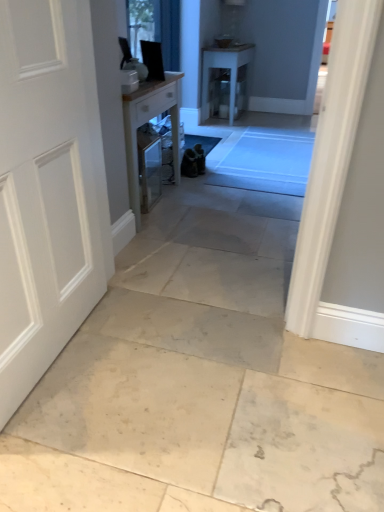
Question: From the image's perspective, does clear glass window at upper center appear lower than white matte door at left?

Choices:
 (A) yes
 (B) no

Answer: (B)

Question: Can you confirm if clear glass window at upper center is positioned to the right of white matte door at left?

Choices:
 (A) no
 (B) yes

Answer: (B)

Question: Is clear glass window at upper center in front of white matte door at left?

Choices:
 (A) yes
 (B) no

Answer: (B)

Question: Is clear glass window at upper center thinner than white matte door at left?

Choices:
 (A) yes
 (B) no

Answer: (A)

Question: From a real-world perspective, is clear glass window at upper center on white matte door at left?

Choices:
 (A) yes
 (B) no

Answer: (A)

Question: Is white matte door at left inside or outside of clear glass window at upper center?

Choices:
 (A) outside
 (B) inside

Answer: (A)

Question: From the image's perspective, relative to clear glass window at upper center, is white matte door at left above or below?

Choices:
 (A) above
 (B) below

Answer: (B)

Question: From a real-world perspective, is white matte door at left above or below clear glass window at upper center?

Choices:
 (A) above
 (B) below

Answer: (B)

Question: Is white matte door at left bigger or smaller than clear glass window at upper center?

Choices:
 (A) big
 (B) small

Answer: (A)

Question: Is clear glass window at upper center inside the boundaries of wooden table at center, which is the second table in top-to-bottom order, or outside?

Choices:
 (A) inside
 (B) outside

Answer: (B)

Question: From a real-world perspective, relative to wooden table at center, the second table in the right-to-left sequence, is clear glass window at upper center vertically above or below?

Choices:
 (A) below
 (B) above

Answer: (B)

Question: Is clear glass window at upper center in front of or behind wooden table at center, positioned as the 2th table in back-to-front order, in the image?

Choices:
 (A) behind
 (B) front

Answer: (A)

Question: From the image's perspective, is clear glass window at upper center located above or below wooden table at center, which appears as the 1th table when viewed from the left?

Choices:
 (A) below
 (B) above

Answer: (B)

Question: From a real-world perspective, is white matte door at left above or below wooden table at center, which appears as the 1th table when viewed from the left?

Choices:
 (A) above
 (B) below

Answer: (A)

Question: Is point (67, 16) closer or farther from the camera than point (175, 109)?

Choices:
 (A) closer
 (B) farther

Answer: (A)